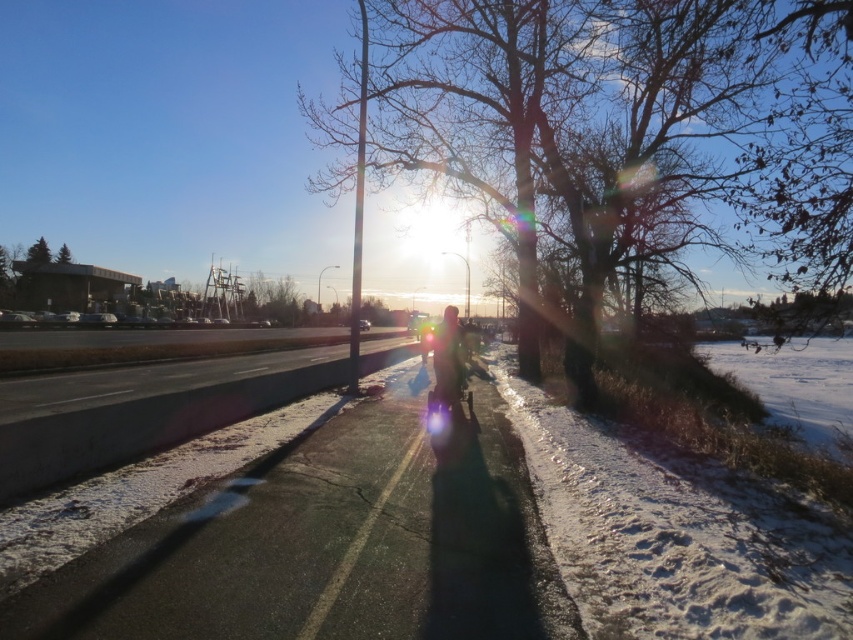
You are a delivery person who needs to deliver a package to the end of the road. You have a map that shows the smooth asphalt road at center and the matte black jacket at center. According to the map, which object is smaller in size?

The smooth asphalt road at center is smaller in size compared to the matte black jacket at center according to the map.

You are a photographer trying to capture the winter scene. You notice the bare branches at center and the smooth asphalt road at center. Which object should you focus on if you want to emphasize a larger subject in your photo?

The bare branches at center is larger in size than the smooth asphalt road at center, so focusing on the bare branches at center will emphasize a larger subject in the photo.